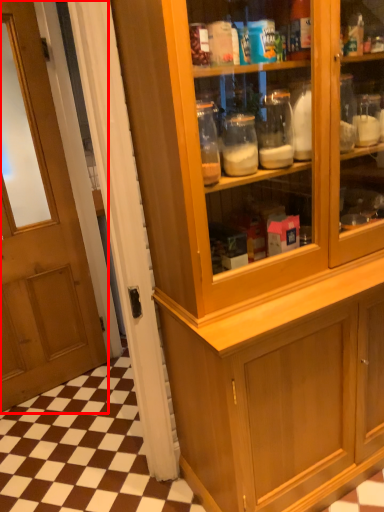
Question: In this image, where is door (annotated by the red box) located relative to cabinetry?

Choices:
 (A) right
 (B) left

Answer: (B)